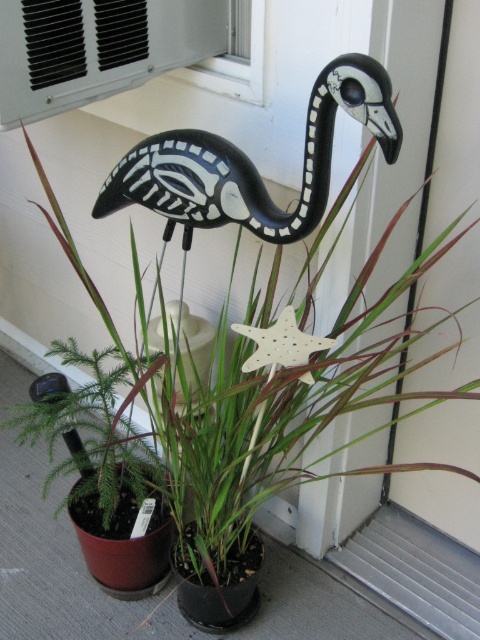
Question: Does black matte plastic bird at upper center appear over white plastic air conditioner at upper center?

Choices:
 (A) no
 (B) yes

Answer: (A)

Question: Among these objects, which one is nearest to the camera?

Choices:
 (A) white plastic air conditioner at upper center
 (B) white matte star at center
 (C) black matte plastic bird at upper center

Answer: (C)

Question: Which point appears farthest from the camera in this image?

Choices:
 (A) (214, 54)
 (B) (137, 160)
 (C) (268, 346)

Answer: (A)

Question: Does white plastic air conditioner at upper center appear on the right side of white matte star at center?

Choices:
 (A) yes
 (B) no

Answer: (B)

Question: Which point is closer to the camera?

Choices:
 (A) white plastic air conditioner at upper center
 (B) white matte star at center

Answer: (A)

Question: Does white plastic air conditioner at upper center have a smaller size compared to white matte star at center?

Choices:
 (A) no
 (B) yes

Answer: (A)